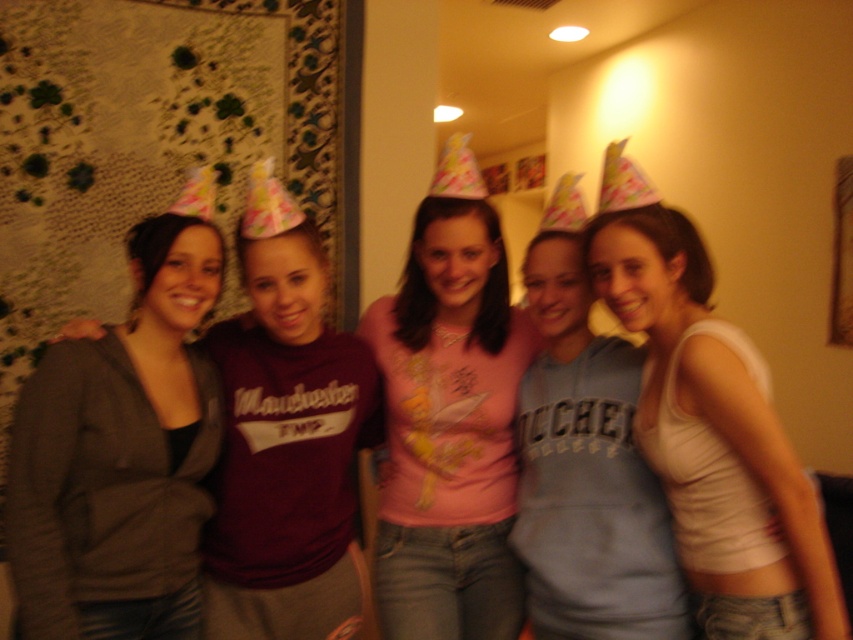
You are organizing a photo shoot and need to ensure that the matte gray hoodie at center and the pink fabric shirt at center are visible in the final image. Based on their positions, which clothing item should you focus on first to ensure both are in frame?

The matte gray hoodie at center is above the pink fabric shirt at center, so focusing on the matte gray hoodie at center first will ensure both are in frame as the pink fabric shirt at center is positioned below it.

You are standing in the hallway and want to find the pink fabric shirt at center. Based on the coordinates provided, where should you look relative to the hallway walls?

The pink fabric shirt at center is located at coordinates point (450,429), which means it is positioned 67.3 percent from the left wall and 52.8 percent from the bottom of the hallway.

You are organizing a clothing donation drive and need to determine which of the two items, the matte gray hoodie at center or the pink fabric shirt at center, can fit into a donation box that has a maximum width of 40 cm. Which item is more likely to fit?

The matte gray hoodie at center has a width less than the pink fabric shirt at center, so the matte gray hoodie at center is more likely to fit into the donation box with a 40 cm width limit.